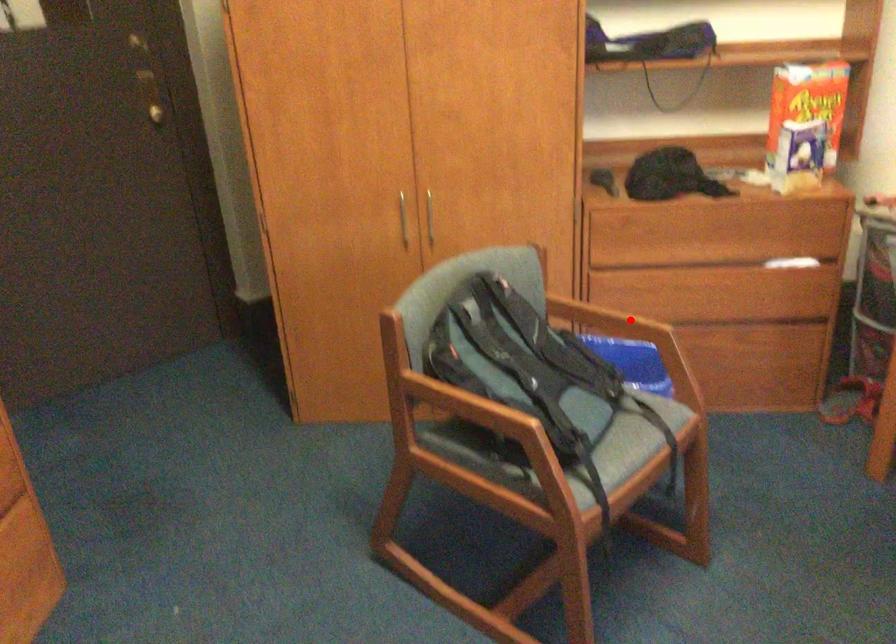
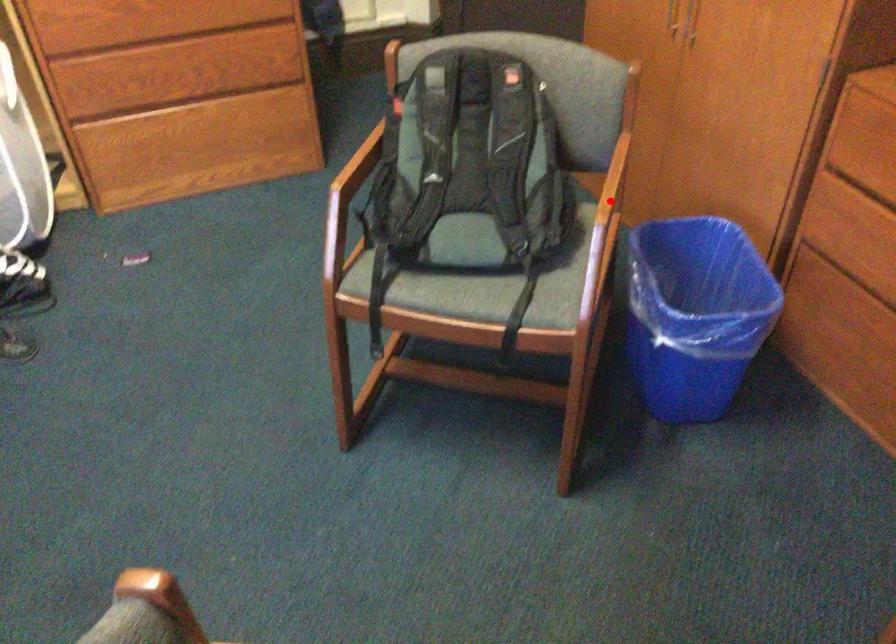
I am providing you with two images of the same scene from different viewpoints. A red point is marked on the first image and another point is marked on the second image. Do the highlighted points in image1 and image2 indicate the same real-world spot?

Yes